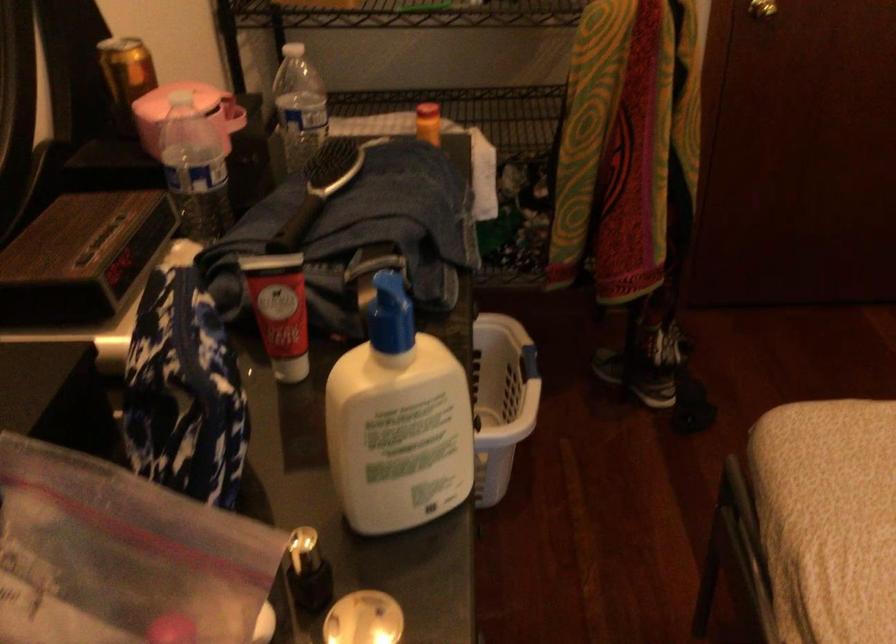
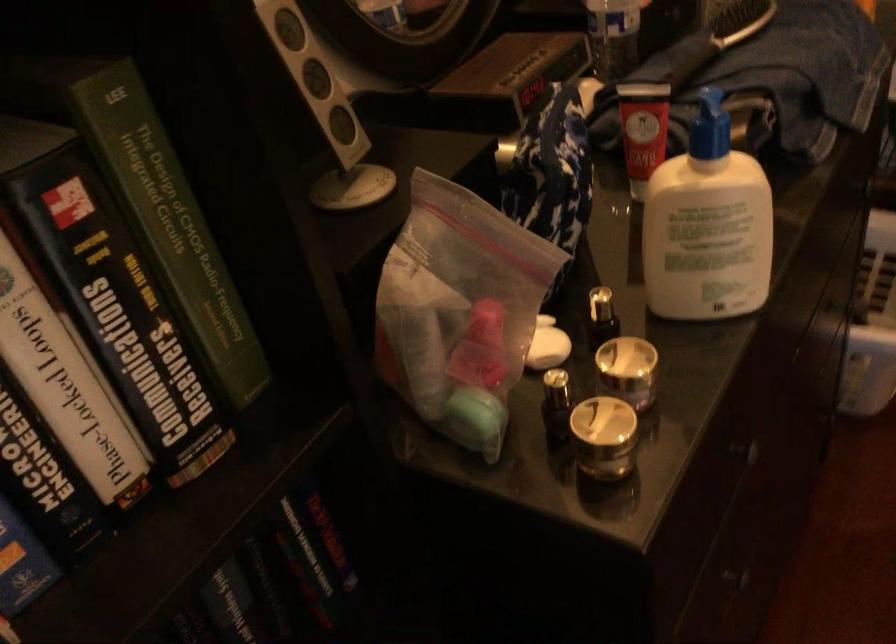
In the second image, find the point that corresponds to point 83,261 in the first image.

(506, 80)